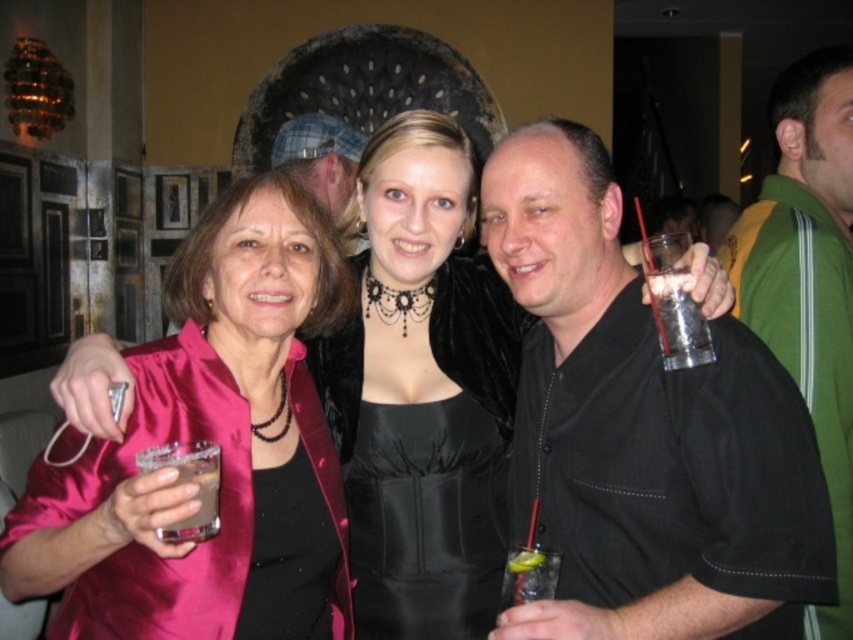
What do you see at coordinates (643, 429) in the screenshot?
I see `black matte shirt at center` at bounding box center [643, 429].

Between black matte shirt at center and satin pink jacket at left, which one is positioned higher?

Positioned higher is black matte shirt at center.

Which is in front, point (647, 330) or point (239, 513)?

Point (239, 513)

Where is `black matte shirt at center`? This screenshot has height=640, width=853. black matte shirt at center is located at coordinates (643, 429).

Between satin pink dress at center and black satin dress at center, which one has less height?

Standing shorter between the two is black satin dress at center.

Which is below, satin pink dress at center or black satin dress at center?

black satin dress at center

Does point (456, 276) come farther from viewer compared to point (467, 552)?

That is True.

At what (x,y) coordinates should I click in order to perform the action: click on satin pink dress at center. Please return your answer as a coordinate pair (x, y). Looking at the image, I should click on (421, 289).

Who is lower down, black satin dress at center or brown liquid at lower left?

black satin dress at center

Does black satin dress at center have a lesser width compared to brown liquid at lower left?

No.

Is point (367, 534) in front of point (213, 449)?

No, (367, 534) is behind (213, 449).

Locate an element on the screen. This screenshot has height=640, width=853. black satin dress at center is located at coordinates (426, 518).